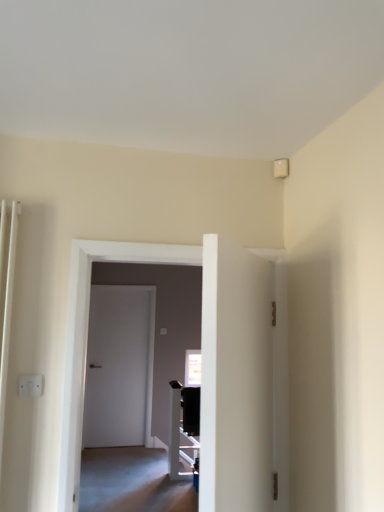
Where is `black glossy tv at center`? The height and width of the screenshot is (512, 384). black glossy tv at center is located at coordinates (183, 426).

Describe the element at coordinates (183, 426) in the screenshot. The image size is (384, 512). I see `black glossy tv at center` at that location.

At what (x,y) coordinates should I click in order to perform the action: click on black glossy tv at center. Please return your answer as a coordinate pair (x, y). This screenshot has width=384, height=512. Looking at the image, I should click on (183, 426).